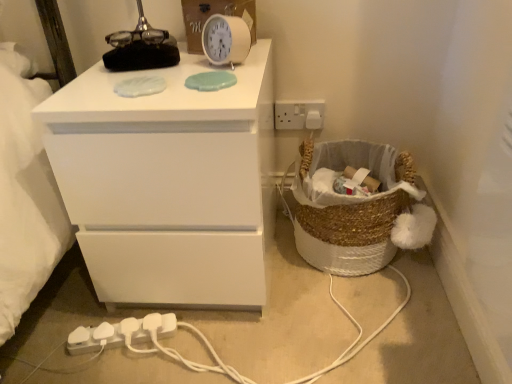
In order to click on empty space that is to the right of white matte chest of drawers at upper left in this screenshot , I will do `click(346, 303)`.